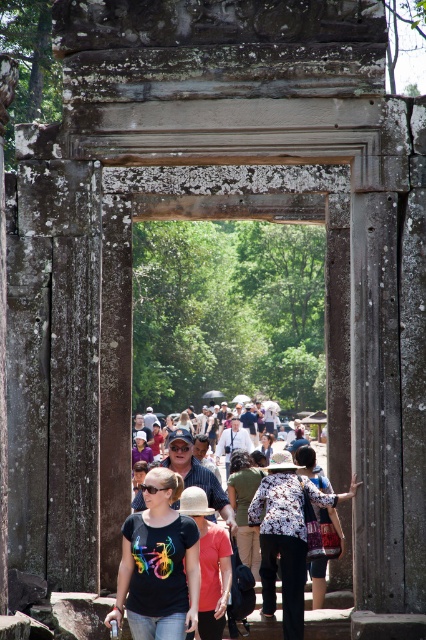
Between point (175, 624) and point (296, 456), which one is positioned behind?

The point (296, 456) is more distant.

Does point (175, 560) come in front of point (233, 493)?

Yes, it is in front of point (233, 493).

Is point (132, 518) more distant than point (339, 522)?

No, it is not.

Locate an element on the screen. The image size is (426, 640). black matte t-shirt at center is located at coordinates (158, 564).

Does floral-patterned fabric at center have a smaller size compared to beige woven hat at center?

No, floral-patterned fabric at center is not smaller than beige woven hat at center.

Is point (305, 572) positioned in front of point (216, 570)?

No, (305, 572) is behind (216, 570).

This screenshot has height=640, width=426. What do you see at coordinates (285, 536) in the screenshot?
I see `floral-patterned fabric at center` at bounding box center [285, 536].

At what (x,y) coordinates should I click in order to perform the action: click on floral-patterned fabric at center. Please return your answer as a coordinate pair (x, y). This screenshot has height=640, width=426. Looking at the image, I should click on (285, 536).

This screenshot has height=640, width=426. In order to click on black matte t-shirt at center in this screenshot , I will do `click(158, 564)`.

Can you confirm if black matte t-shirt at center is positioned to the left of patterned fabric bag at center?

Indeed, black matte t-shirt at center is positioned on the left side of patterned fabric bag at center.

Image resolution: width=426 pixels, height=640 pixels. In order to click on black matte t-shirt at center in this screenshot , I will do `click(158, 564)`.